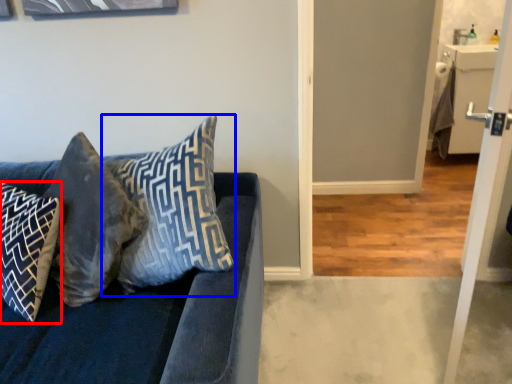
Question: Among these objects, which one is farthest to the camera, pillow (highlighted by a red box) or pillow (highlighted by a blue box)?

Choices:
 (A) pillow
 (B) pillow

Answer: (A)